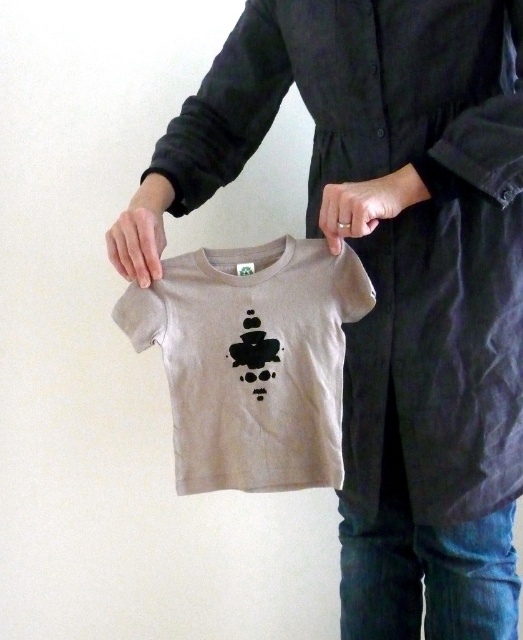
You are a fashion designer analyzing the placement of two points on the T shirt. The points are labeled as point (297, 461) and point (404, 208). Which point is closer to the viewer?

Point (404, 208) is closer to the viewer than point (297, 461) because the description states that point (297, 461) is behind point (404, 208).